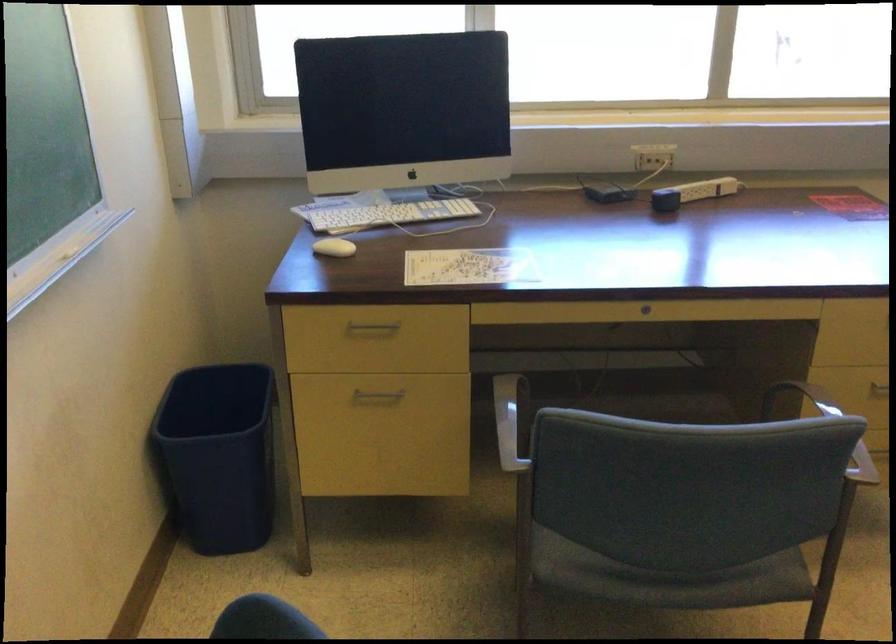
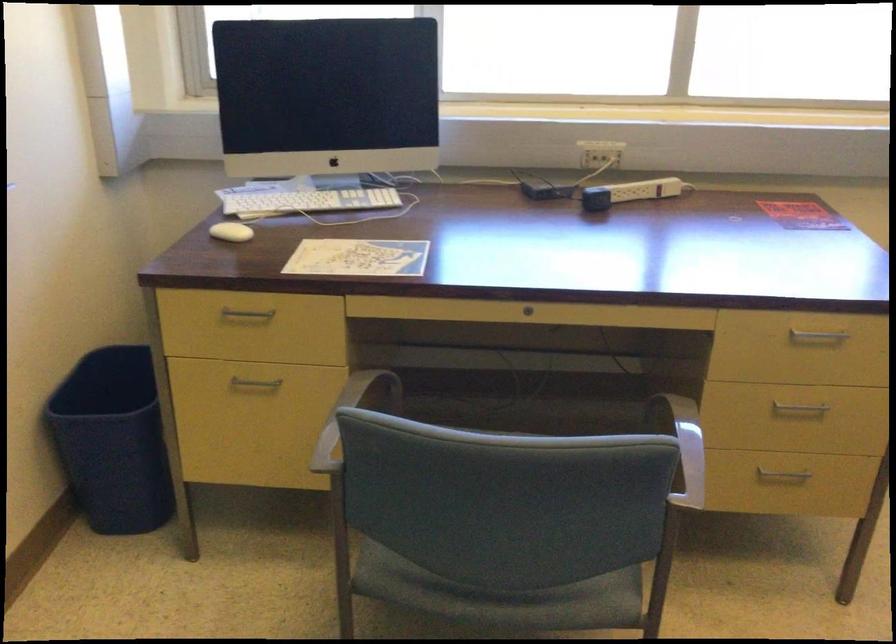
Find the pixel in the second image that matches point (702, 187) in the first image.

(642, 190)